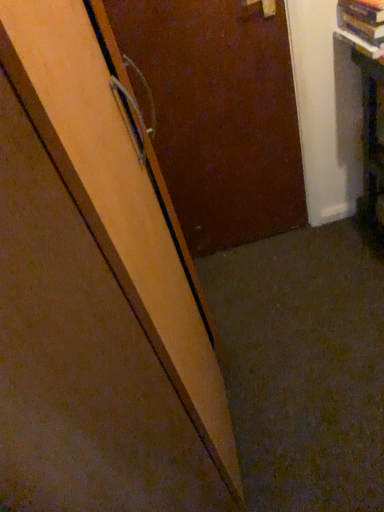
Locate an element on the screen. hardcover book at upper right is located at coordinates coord(362,20).

The image size is (384, 512). What do you see at coordinates (362, 20) in the screenshot?
I see `hardcover book at upper right` at bounding box center [362, 20].

Image resolution: width=384 pixels, height=512 pixels. I want to click on hardcover book at upper right, so click(362, 20).